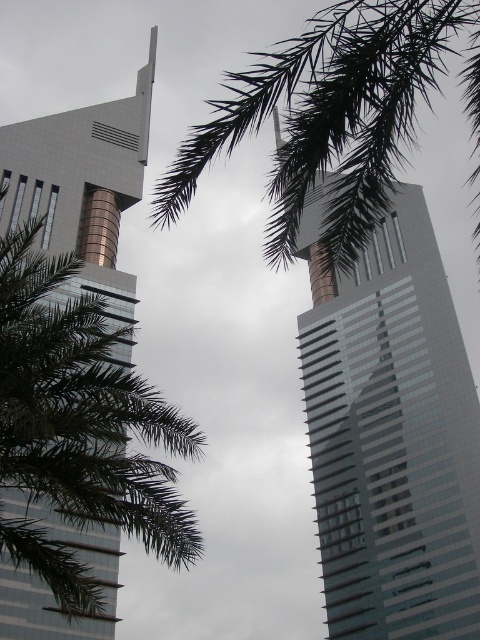
Question: Does glassy reflective skyscraper at center have a greater width compared to metallic glass skyscraper at left?

Choices:
 (A) yes
 (B) no

Answer: (A)

Question: From the image, what is the correct spatial relationship of glassy reflective skyscraper at center in relation to green leafy palm at upper center?

Choices:
 (A) right
 (B) left

Answer: (B)

Question: Which object is the farthest from the glassy reflective skyscraper at center?

Choices:
 (A) metallic glass skyscraper at left
 (B) green leafy palm at upper center

Answer: (A)

Question: Can you confirm if green leafy palm at upper center is bigger than metallic glass skyscraper at left?

Choices:
 (A) yes
 (B) no

Answer: (A)

Question: Estimate the real-world distances between objects in this image. Which object is farther from the glassy reflective skyscraper at center?

Choices:
 (A) metallic glass skyscraper at left
 (B) green leafy palm at upper center

Answer: (A)

Question: Among these objects, which one is nearest to the camera?

Choices:
 (A) green leafy palm at upper center
 (B) glassy reflective skyscraper at center
 (C) metallic glass skyscraper at left

Answer: (A)